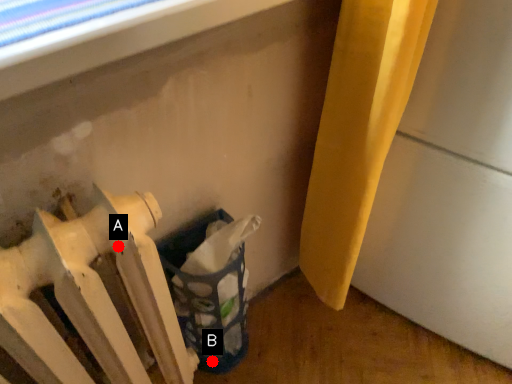
Question: Two points are circled on the image, labeled by A and B beside each circle. Which point is farther to the camera?

Choices:
 (A) A is further
 (B) B is further

Answer: (B)